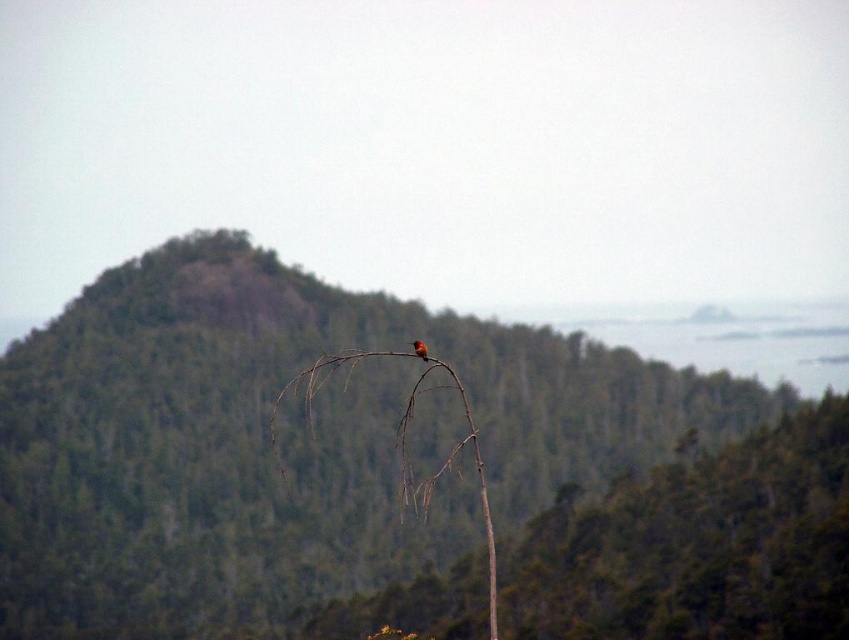
Is green textured mountain at center bigger than brown wood tree at center?

Yes, green textured mountain at center is bigger than brown wood tree at center.

Where is `green textured mountain at center`? green textured mountain at center is located at coordinates (287, 442).

Is point (104, 634) positioned in front of point (810, 573)?

No, it is not.

You are a GUI agent. You are given a task and a screenshot of the screen. Output one action in this format:
    pyautogui.click(x=<x>, y=<y>)
    Task: Click on the green textured mountain at center
    The width and height of the screenshot is (849, 640).
    Given the screenshot: What is the action you would take?
    pyautogui.click(x=287, y=442)

Consider the image. Can you confirm if green textured mountain at center is shorter than bright orange bird at center?

No, green textured mountain at center is not shorter than bright orange bird at center.

Which is in front, point (516, 515) or point (415, 349)?

Point (415, 349) is in front.

Which is behind, point (128, 384) or point (424, 358)?

The point (128, 384) is more distant.

Where is `green textured mountain at center`? The height and width of the screenshot is (640, 849). green textured mountain at center is located at coordinates tap(287, 442).

From the picture: Is green textured mountain at center bigger than brown wood branch at center?

Indeed, green textured mountain at center has a larger size compared to brown wood branch at center.

Is green textured mountain at center shorter than brown wood branch at center?

Incorrect, green textured mountain at center's height does not fall short of brown wood branch at center's.

Who is more forward, (488, 324) or (442, 365)?

Positioned in front is point (442, 365).

Locate an element on the screen. green textured mountain at center is located at coordinates (287, 442).